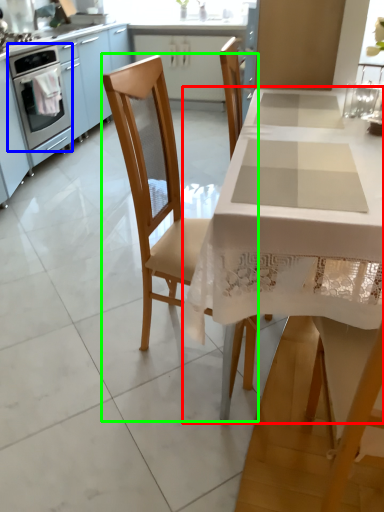
Question: Which object is positioned closest to table (highlighted by a red box)? Select from home appliance (highlighted by a blue box) and chair (highlighted by a green box).

Choices:
 (A) home appliance
 (B) chair

Answer: (B)